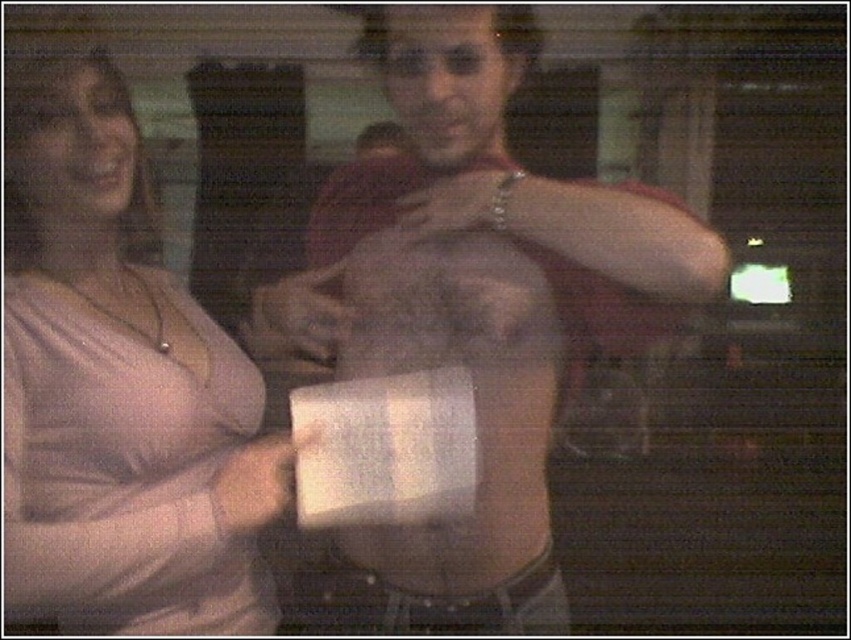
Question: Can you confirm if pink matte shirt at left is positioned above smooth skin hand at center?

Choices:
 (A) yes
 (B) no

Answer: (B)

Question: Which object is the farthest from the white matte paper at center?

Choices:
 (A) smooth skin hand at center
 (B) matte gray shirt at center

Answer: (A)

Question: Which object is closer to the camera taking this photo?

Choices:
 (A) matte gray shirt at center
 (B) smooth skin hand at center
 (C) white matte paper at center

Answer: (A)

Question: Where is matte gray shirt at center located in relation to white matte paper at center in the image?

Choices:
 (A) left
 (B) right

Answer: (B)

Question: Does matte gray shirt at center appear on the left side of pink matte shirt at left?

Choices:
 (A) yes
 (B) no

Answer: (B)

Question: Estimate the real-world distances between objects in this image. Which object is closer to the matte gray shirt at center?

Choices:
 (A) smooth skin hand at center
 (B) pink matte shirt at left

Answer: (A)